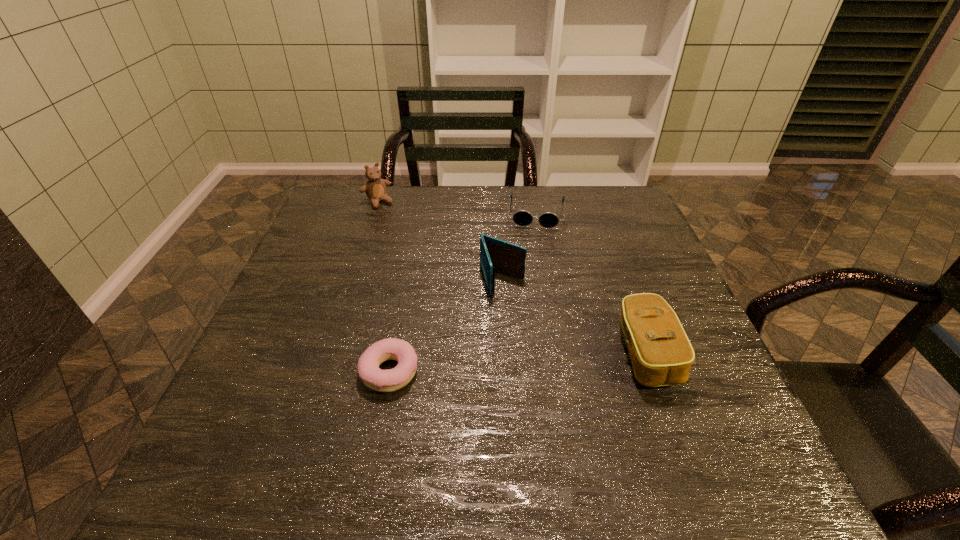
You are a GUI agent. You are given a task and a screenshot of the screen. Output one action in this format:
    pyautogui.click(x=<x>, y=<y>)
    Task: Click on the object at the right edge
    The image size is (960, 540).
    Given the screenshot: What is the action you would take?
    pyautogui.click(x=661, y=354)

Locate an element on the screen. This screenshot has width=960, height=540. object that is at the far left corner is located at coordinates (375, 189).

You are a GUI agent. You are given a task and a screenshot of the screen. Output one action in this format:
    pyautogui.click(x=<x>, y=<y>)
    Task: Click on the free spot at the far edge of the desktop
    Image resolution: width=960 pixels, height=540 pixels.
    Given the screenshot: What is the action you would take?
    pyautogui.click(x=398, y=220)

Locate an element on the screen. The image size is (960, 540). vacant region at the right edge of the desktop is located at coordinates (706, 365).

The image size is (960, 540). In the image, there is a desktop. Find the location of `free region at the near left corner`. free region at the near left corner is located at coordinates (283, 419).

Find the location of a particular element. Image resolution: width=960 pixels, height=540 pixels. vacant space at the far right corner of the desktop is located at coordinates (585, 210).

At what (x,y) coordinates should I click in order to perform the action: click on free space at the near right corner of the desktop. Please return your answer as a coordinate pair (x, y). Image resolution: width=960 pixels, height=540 pixels. Looking at the image, I should click on (676, 410).

You are a GUI agent. You are given a task and a screenshot of the screen. Output one action in this format:
    pyautogui.click(x=<x>, y=<y>)
    Task: Click on the empty space that is in between the sunglasses and the second object from left to right
    
    Given the screenshot: What is the action you would take?
    pyautogui.click(x=463, y=292)

Identify the location of empty location between the leftmost object and the third farthest object. (440, 241).

Where is `free space between the leftmost object and the rightmost object`? The width and height of the screenshot is (960, 540). free space between the leftmost object and the rightmost object is located at coordinates (512, 278).